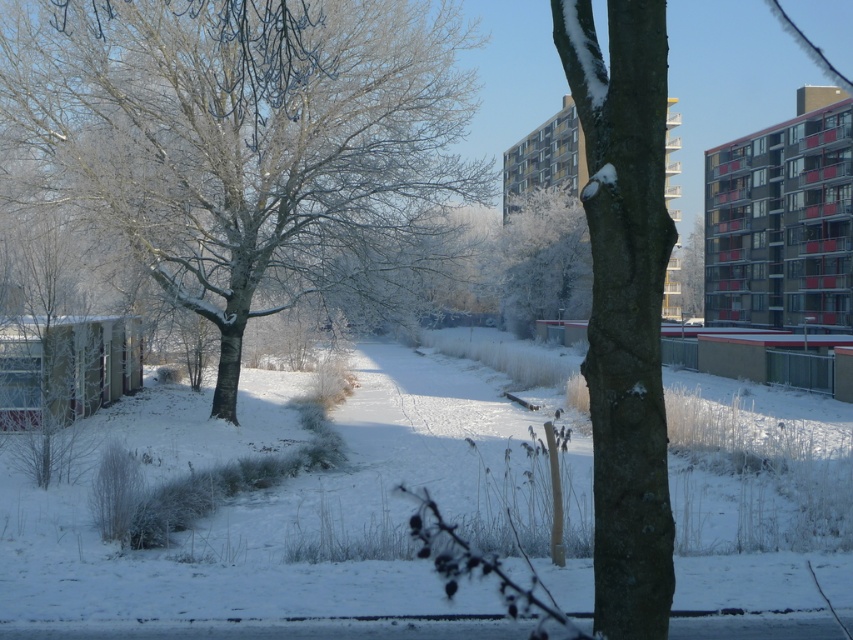
Which of these two, snowy bark tree at center or frosted white tree at center, stands taller?

With more height is frosted white tree at center.

Measure the distance from snowy bark tree at center to frosted white tree at center.

73.22 meters

This screenshot has height=640, width=853. What do you see at coordinates (624, 305) in the screenshot?
I see `snowy bark tree at center` at bounding box center [624, 305].

What are the coordinates of `snowy bark tree at center` in the screenshot? It's located at (624, 305).

In the scene shown: Who is positioned more to the right, frosted white tree at left or frosted white tree at center?

frosted white tree at center is more to the right.

Between frosted white tree at left and frosted white tree at center, which one has less height?

Standing shorter between the two is frosted white tree at center.

Which is behind, point (335, 61) or point (534, 220)?

The point (534, 220) is more distant.

You are a GUI agent. You are given a task and a screenshot of the screen. Output one action in this format:
    pyautogui.click(x=<x>, y=<y>)
    Task: Click on the frosted white tree at left
    This screenshot has width=853, height=640.
    Given the screenshot: What is the action you would take?
    pyautogui.click(x=245, y=138)

Between point (138, 77) and point (641, 310), which one is positioned in front?

Point (641, 310)

Does frosted white tree at left have a greater height compared to snowy bark tree at center?

Answer: Yes, frosted white tree at left is taller than snowy bark tree at center.

Which is behind, point (154, 202) or point (656, 52)?

Point (154, 202)

Where is `frosted white tree at left`? The width and height of the screenshot is (853, 640). frosted white tree at left is located at coordinates (245, 138).